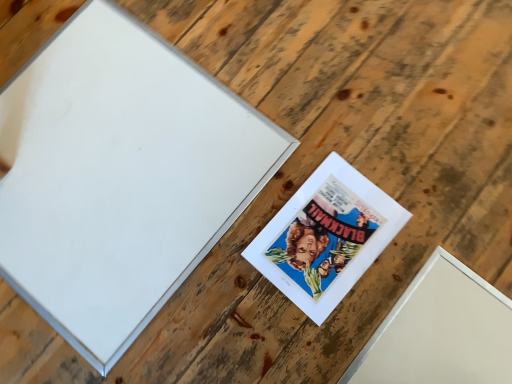
Image resolution: width=512 pixels, height=384 pixels. What are the coordinates of `vacant space that is to the left of matte paper picture frame at center, placed as the 2th picture frame when sorted from left to right` in the screenshot? It's located at (211, 258).